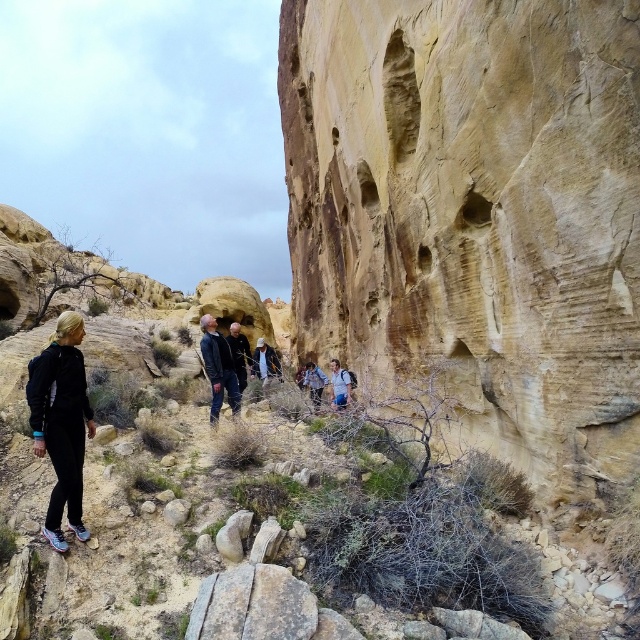
Who is taller, light brown leather jacket at center or blue denim jacket at center?

With more height is light brown leather jacket at center.

Between point (262, 353) and point (317, 376), which one is positioned behind?

The point (317, 376) is more distant.

The image size is (640, 640). I want to click on light brown leather jacket at center, so click(266, 364).

Is black matte pants at left thinner than light blue denim jacket at center?

No.

Is point (74, 476) behind point (344, 403)?

No, (74, 476) is in front of (344, 403).

I want to click on black matte pants at left, so click(61, 422).

Does black matte pants at left have a greater width compared to blue denim jacket at center?

Indeed, black matte pants at left has a greater width compared to blue denim jacket at center.

Between point (80, 536) and point (314, 371), which one is positioned behind?

The point (314, 371) is more distant.

The width and height of the screenshot is (640, 640). Identify the location of black matte pants at left. (61, 422).

Image resolution: width=640 pixels, height=640 pixels. I want to click on black matte pants at left, so click(x=61, y=422).